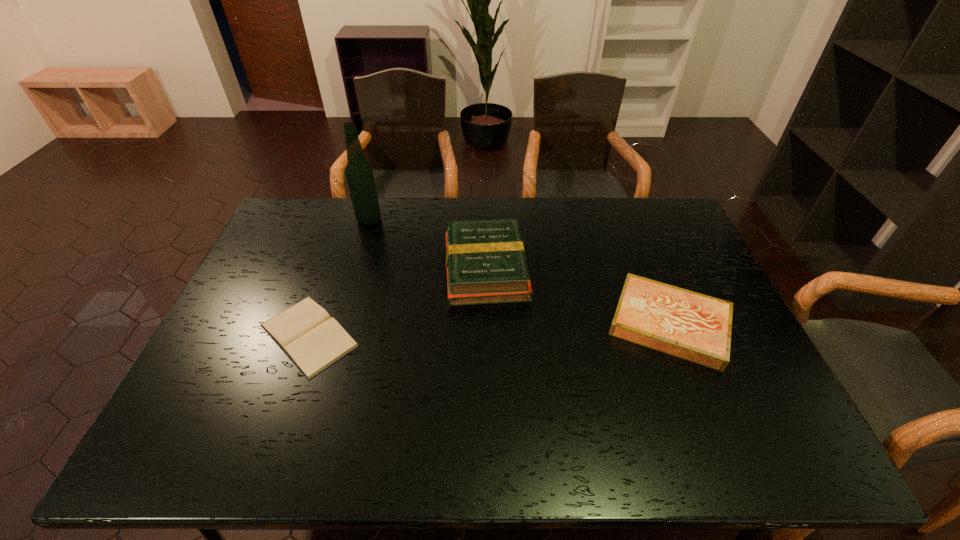
Image resolution: width=960 pixels, height=540 pixels. I want to click on vacant space positioned 0.330m on the back of the Bible, so click(x=347, y=229).

Where is `alcohol that is positioned at the far edge`? alcohol that is positioned at the far edge is located at coordinates (359, 173).

Locate an element on the screen. hardback book that is at the far edge is located at coordinates (485, 259).

You are a GUI agent. You are given a task and a screenshot of the screen. Output one action in this format:
    pyautogui.click(x=<x>, y=<y>)
    Task: Click on the object at the left edge
    
    Given the screenshot: What is the action you would take?
    pyautogui.click(x=313, y=340)

In order to click on object located at the right edge in this screenshot , I will do `click(695, 327)`.

At what (x,y) coordinates should I click in order to perform the action: click on free space at the far edge of the desktop. Please return your answer as a coordinate pair (x, y). Looking at the image, I should click on (590, 217).

Locate an element on the screen. The image size is (960, 540). blank space at the near edge is located at coordinates (670, 457).

Locate an element on the screen. vacant region at the left edge of the desktop is located at coordinates (219, 333).

Find the location of a particular element. The height and width of the screenshot is (540, 960). vacant area at the right edge of the desktop is located at coordinates (669, 242).

Identify the location of vacant space at the far left corner of the desktop. (288, 210).